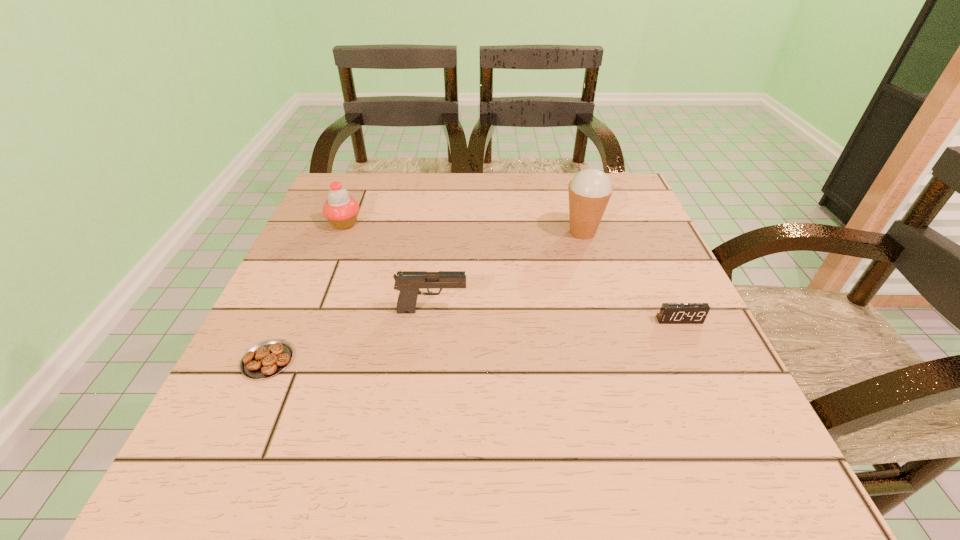
Find the location of a particular element. Image resolution: width=960 pixels, height=540 pixels. the tallest object is located at coordinates (590, 189).

Image resolution: width=960 pixels, height=540 pixels. I want to click on icecream, so click(590, 189).

Locate an element on the screen. The width and height of the screenshot is (960, 540). cupcake is located at coordinates (341, 210).

Where is `the third farthest object`? Image resolution: width=960 pixels, height=540 pixels. the third farthest object is located at coordinates coord(408,283).

The image size is (960, 540). I want to click on the third object from right to left, so click(408, 283).

Where is `the second shortest object`? The image size is (960, 540). the second shortest object is located at coordinates [x=670, y=313].

The image size is (960, 540). In order to click on alarm clock in this screenshot , I will do `click(670, 313)`.

Identify the location of the shortest object. (268, 358).

Find the location of a particular element. Image resolution: width=960 pixels, height=540 pixels. the nearest object is located at coordinates (268, 358).

This screenshot has width=960, height=540. In order to click on free point located on the right of the tallest object in this screenshot , I will do `click(624, 232)`.